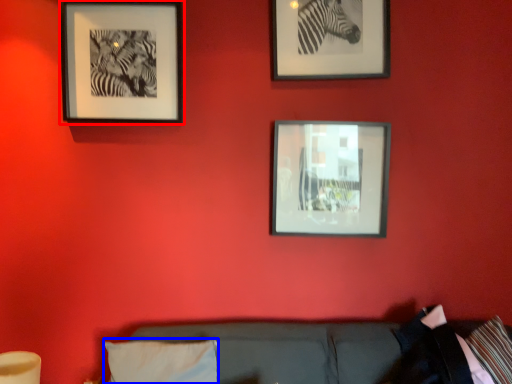
Question: Which object is further to the camera taking this photo, picture frame (highlighted by a red box) or pillow (highlighted by a blue box)?

Choices:
 (A) picture frame
 (B) pillow

Answer: (A)